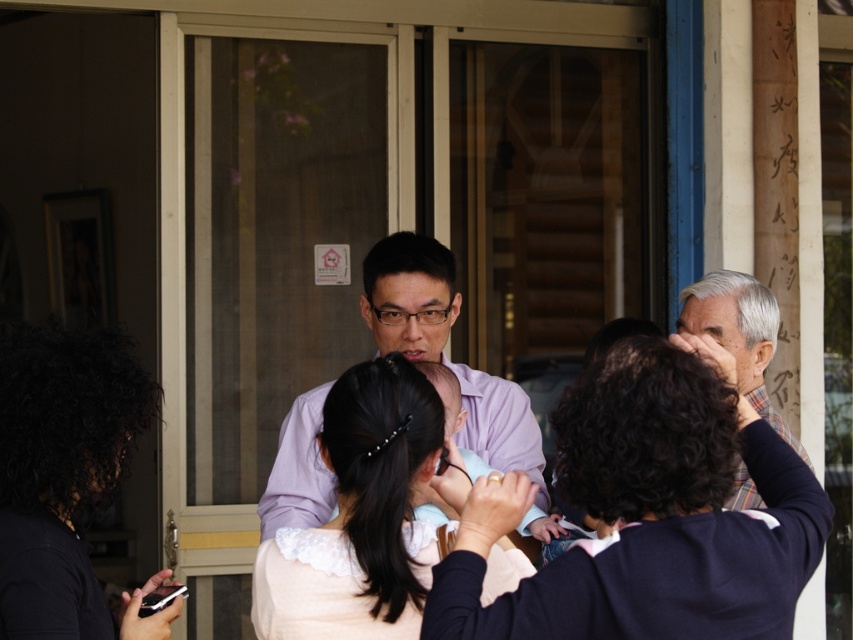
Find the location of a particular element. The width and height of the screenshot is (853, 640). dark brown hair at center is located at coordinates (648, 515).

Is dark brown hair at center above matte purple shirt at center?

No.

Between point (675, 365) and point (537, 481), which one is positioned in front?

Point (675, 365) is more forward.

Find the location of a particular element. This screenshot has height=640, width=853. dark brown hair at center is located at coordinates (648, 515).

Which of these two, light pink fabric at center or matte purple shirt at center, stands shorter?

Standing shorter between the two is light pink fabric at center.

Is point (270, 563) closer to viewer compared to point (393, 310)?

Yes, it is in front of point (393, 310).

The width and height of the screenshot is (853, 640). In order to click on light pink fabric at center in this screenshot , I will do `click(360, 516)`.

This screenshot has width=853, height=640. Describe the element at coordinates (65, 477) in the screenshot. I see `black matte hair at lower left` at that location.

Is black matte hair at lower left thinner than matte purple shirt at center?

Correct, black matte hair at lower left's width is less than matte purple shirt at center's.

Where is `black matte hair at lower left`? black matte hair at lower left is located at coordinates pyautogui.click(x=65, y=477).

I want to click on black matte hair at lower left, so click(x=65, y=477).